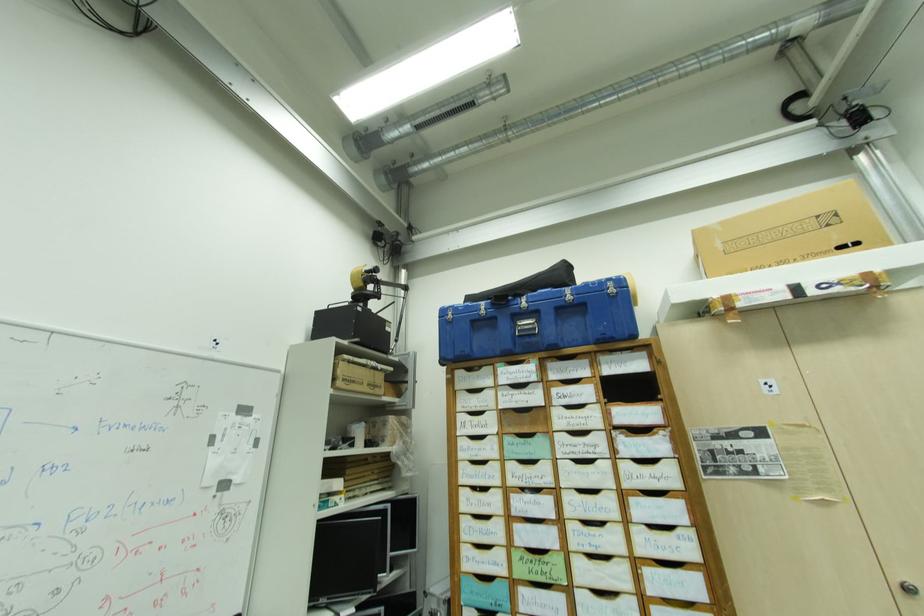
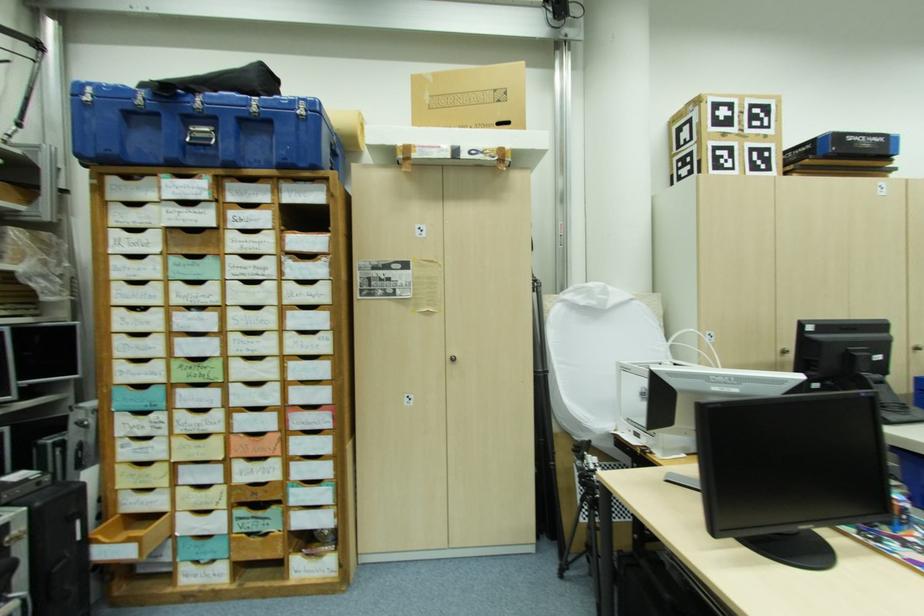
The images are taken continuously from a first-person perspective. In which direction is your viewpoint rotating?

The rotation direction of the camera is right-down.